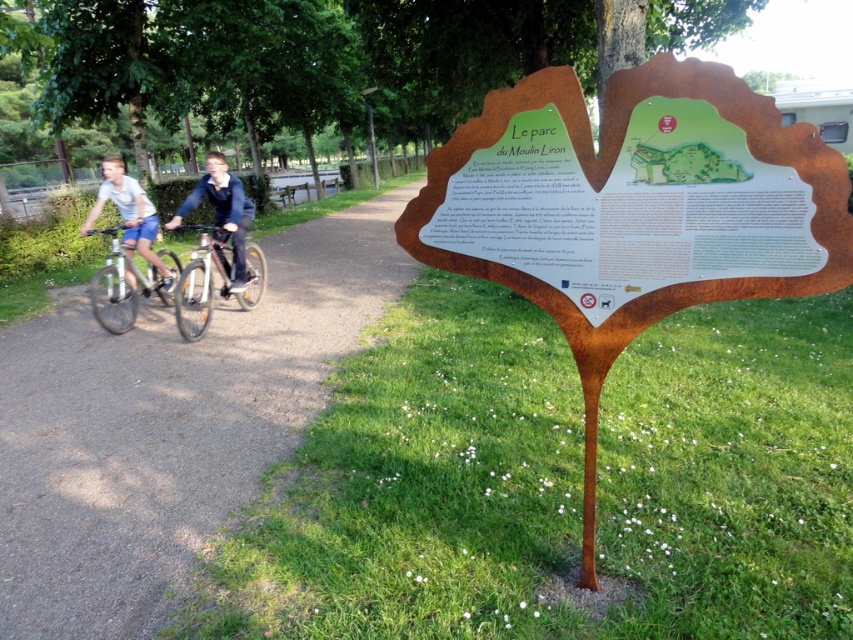
You are standing at the point with coordinates point (113, 186) and want to walk towards the point with coordinates point (189, 268). Which direction should you face to walk directly towards your destination?

Since point (189, 268) is in front of point (113, 186), you should face forward to walk directly towards your destination.

You are a visitor in the park and want to find your friend who is wearing a blue denim jacket at center. You see the matte white bicycles at left. In which direction relative to the bicycles should you look to find your friend?

The matte white bicycles at left is located below the blue denim jacket at center, so you should look above the matte white bicycles at left to find your friend wearing the blue denim jacket at center.

You are a visitor at the park and want to take a photo of the white matte bicycle at left and the matte white shirt at left. Based on their positions, which object should you frame first in your camera viewfinder to capture both in the same shot?

The white matte bicycle at left is positioned on the right side of matte white shirt at left, so you should frame the matte white shirt at left first on the left side of the viewfinder and then include the white matte bicycle at left on the right side to capture both in the same shot.